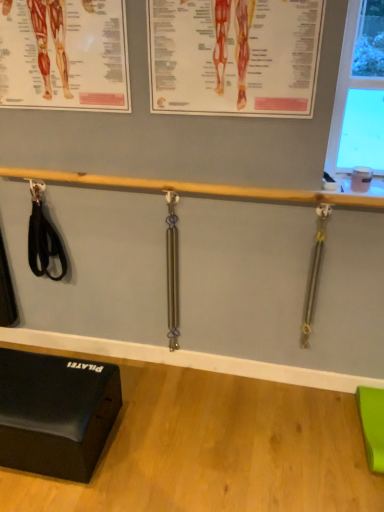
This screenshot has height=512, width=384. I want to click on black rubber exercise block at lower left, so click(55, 413).

What do you see at coordinates (314, 273) in the screenshot?
I see `gold metallic weight at right, the first weight when ordered from right to left` at bounding box center [314, 273].

This screenshot has width=384, height=512. Describe the element at coordinates (234, 56) in the screenshot. I see `orange paper poster at upper center, positioned as the first poster page in right-to-left order` at that location.

What is the approximate width of matte paper poster at upper left, positioned as the second poster page in right-to-left order?

matte paper poster at upper left, positioned as the second poster page in right-to-left order, is 3.39 centimeters wide.

This screenshot has height=512, width=384. Describe the element at coordinates (196, 188) in the screenshot. I see `wooden bar at center` at that location.

Image resolution: width=384 pixels, height=512 pixels. In order to click on black rubber exercise block at lower left in this screenshot , I will do `click(55, 413)`.

How many degrees apart are the facing directions of polished metal weight at center, the 2th weight in the right-to-left sequence, and wooden bar at center?

The angular difference between polished metal weight at center, the 2th weight in the right-to-left sequence, and wooden bar at center is 0.28 degrees.

Considering the points (175, 199) and (3, 170), which point is in front, point (175, 199) or point (3, 170)?

The point (175, 199) is closer.

Which object is more forward, polished metal weight at center, which appears as the 1th weight when viewed from the left, or wooden bar at center?

wooden bar at center is closer to the camera.

Is polished metal weight at center, the 2th weight in the right-to-left sequence, turned away from wooden bar at center?

No, wooden bar at center is not at the back of polished metal weight at center, the 2th weight in the right-to-left sequence.

How much distance is there between wooden bar at center and polished metal weight at center, the 2th weight in the right-to-left sequence?

They are 15.19 inches apart.

Is wooden bar at center closer to the viewer compared to polished metal weight at center, the 2th weight in the right-to-left sequence?

That is True.

Consider the image. In terms of size, does wooden bar at center appear bigger or smaller than polished metal weight at center, the 2th weight in the right-to-left sequence?

In the image, wooden bar at center appears to be larger than polished metal weight at center, the 2th weight in the right-to-left sequence.

Does wooden bar at center turn towards polished metal weight at center, which appears as the 1th weight when viewed from the left?

No, wooden bar at center is not oriented towards polished metal weight at center, which appears as the 1th weight when viewed from the left.

Can you confirm if orange paper poster at upper center, which is counted as the 2th poster page, starting from the left, is wider than polished metal weight at center, the 2th weight in the right-to-left sequence?

No.

Considering the positions of points (152, 97) and (177, 309), is point (152, 97) closer to camera compared to point (177, 309)?

Yes, it is in front of point (177, 309).

This screenshot has width=384, height=512. Find the location of `the 2nd weight directly beneath the orange paper poster at upper center, which is counted as the 2th poster page, starting from the left (from a real-world perspective)`. the 2nd weight directly beneath the orange paper poster at upper center, which is counted as the 2th poster page, starting from the left (from a real-world perspective) is located at coordinates (172, 271).

Is polished metal weight at center, the 2th weight in the right-to-left sequence, a part of orange paper poster at upper center, positioned as the first poster page in right-to-left order?

No, polished metal weight at center, the 2th weight in the right-to-left sequence, is not a part of orange paper poster at upper center, positioned as the first poster page in right-to-left order.

Is polished metal weight at center, which appears as the 1th weight when viewed from the left, located outside orange paper poster at upper center, positioned as the first poster page in right-to-left order?

Yes, polished metal weight at center, which appears as the 1th weight when viewed from the left, is located beyond the bounds of orange paper poster at upper center, positioned as the first poster page in right-to-left order.

From the image's perspective, is polished metal weight at center, which appears as the 1th weight when viewed from the left, located beneath orange paper poster at upper center, positioned as the first poster page in right-to-left order?

Indeed, from the image's perspective, polished metal weight at center, which appears as the 1th weight when viewed from the left, is shown beneath orange paper poster at upper center, positioned as the first poster page in right-to-left order.

Between point (171, 240) and point (224, 0), which one is positioned behind?

Point (171, 240)

Considering the positions of objects polished metal weight at center, which appears as the 1th weight when viewed from the left, and orange paper poster at upper center, positioned as the first poster page in right-to-left order, in the image provided, who is behind, polished metal weight at center, which appears as the 1th weight when viewed from the left, or orange paper poster at upper center, positioned as the first poster page in right-to-left order,?

Positioned behind is polished metal weight at center, which appears as the 1th weight when viewed from the left.

From the image's perspective, relative to wooden bar at center, is matte paper poster at upper left, positioned as the second poster page in right-to-left order, above or below?

From the image's perspective, matte paper poster at upper left, positioned as the second poster page in right-to-left order, appears above wooden bar at center.

Which point is more forward, (114, 9) or (9, 173)?

The point (114, 9) is in front.

How distant is matte paper poster at upper left, the first poster page in the left-to-right sequence, from wooden bar at center?

matte paper poster at upper left, the first poster page in the left-to-right sequence, and wooden bar at center are 17.46 inches apart from each other.

Find the location of a particular element. Image resolution: width=384 pixels, height=512 pixels. beam on the right of the matte paper poster at upper left, the first poster page in the left-to-right sequence is located at coordinates (x=196, y=188).

Considering the relative sizes of orange paper poster at upper center, positioned as the first poster page in right-to-left order, and wooden bar at center in the image provided, is orange paper poster at upper center, positioned as the first poster page in right-to-left order, wider than wooden bar at center?

Incorrect, the width of orange paper poster at upper center, positioned as the first poster page in right-to-left order, does not surpass that of wooden bar at center.

From a real-world perspective, is orange paper poster at upper center, which is counted as the 2th poster page, starting from the left, positioned above or below wooden bar at center?

In terms of real-world spatial position, orange paper poster at upper center, which is counted as the 2th poster page, starting from the left, is above wooden bar at center.

What's the angular difference between orange paper poster at upper center, positioned as the first poster page in right-to-left order, and wooden bar at center's facing directions?

There is a 0.309-degree angle between the facing directions of orange paper poster at upper center, positioned as the first poster page in right-to-left order, and wooden bar at center.

From a real-world perspective, relative to polished metal weight at center, the 2th weight in the right-to-left sequence, is matte paper poster at upper left, positioned as the second poster page in right-to-left order, vertically above or below?

In terms of real-world spatial position, matte paper poster at upper left, positioned as the second poster page in right-to-left order, is above polished metal weight at center, the 2th weight in the right-to-left sequence.

Can you tell me how much matte paper poster at upper left, positioned as the second poster page in right-to-left order, and polished metal weight at center, the 2th weight in the right-to-left sequence, differ in facing direction?

0.589 degrees.

Is matte paper poster at upper left, the first poster page in the left-to-right sequence, taller or shorter than polished metal weight at center, which appears as the 1th weight when viewed from the left?

Clearly, matte paper poster at upper left, the first poster page in the left-to-right sequence, is shorter compared to polished metal weight at center, which appears as the 1th weight when viewed from the left.

The image size is (384, 512). In the image, there is a polished metal weight at center, the 2th weight in the right-to-left sequence. What are the coordinates of `beam above it (from the image's perspective)` in the screenshot? It's located at (196, 188).

From the image's perspective, count 2nd weights downward from the wooden bar at center and point to it. Please provide its 2D coordinates.

[(172, 271)]

Which object lies nearer to the anchor point wooden bar at center, orange paper poster at upper center, which is counted as the 2th poster page, starting from the left, or gold metallic weight at right, the first weight when ordered from right to left?

orange paper poster at upper center, which is counted as the 2th poster page, starting from the left, lies closer to wooden bar at center than the other object.

Which object lies nearer to the anchor point polished metal weight at center, the 2th weight in the right-to-left sequence, gold metallic weight at right, acting as the 2th weight starting from the left, or orange paper poster at upper center, which is counted as the 2th poster page, starting from the left?

orange paper poster at upper center, which is counted as the 2th poster page, starting from the left, is closer to polished metal weight at center, the 2th weight in the right-to-left sequence.

Which object lies further to the anchor point orange paper poster at upper center, which is counted as the 2th poster page, starting from the left, polished metal weight at center, the 2th weight in the right-to-left sequence, or matte paper poster at upper left, the first poster page in the left-to-right sequence?

polished metal weight at center, the 2th weight in the right-to-left sequence, is further to orange paper poster at upper center, which is counted as the 2th poster page, starting from the left.

Which object lies nearer to the anchor point matte paper poster at upper left, the first poster page in the left-to-right sequence, wooden bar at center or black rubber exercise block at lower left?

wooden bar at center.

Looking at the image, which one is located further to black rubber exercise block at lower left, matte paper poster at upper left, positioned as the second poster page in right-to-left order, or gold metallic weight at right, acting as the 2th weight starting from the left?

The object further to black rubber exercise block at lower left is matte paper poster at upper left, positioned as the second poster page in right-to-left order.

From the image, which object appears to be farther from matte paper poster at upper left, the first poster page in the left-to-right sequence, orange paper poster at upper center, which is counted as the 2th poster page, starting from the left, or gold metallic weight at right, the first weight when ordered from right to left?

gold metallic weight at right, the first weight when ordered from right to left, lies further to matte paper poster at upper left, the first poster page in the left-to-right sequence, than the other object.

Looking at this image, which object lies nearer to the anchor point black rubber exercise block at lower left, gold metallic weight at right, the first weight when ordered from right to left, or wooden bar at center?

wooden bar at center is positioned closer to the anchor black rubber exercise block at lower left.

Which object lies nearer to the anchor point black rubber exercise block at lower left, matte paper poster at upper left, the first poster page in the left-to-right sequence, or polished metal weight at center, the 2th weight in the right-to-left sequence?

Among the two, polished metal weight at center, the 2th weight in the right-to-left sequence, is located nearer to black rubber exercise block at lower left.

You are a GUI agent. You are given a task and a screenshot of the screen. Output one action in this format:
    pyautogui.click(x=<x>, y=<y>)
    Task: Click on the beam situated between polished metal weight at center, the 2th weight in the right-to-left sequence, and gold metallic weight at right, acting as the 2th weight starting from the left, from left to right
    Image resolution: width=384 pixels, height=512 pixels.
    Given the screenshot: What is the action you would take?
    pyautogui.click(x=196, y=188)

Where is `beam located between matte paper poster at upper left, the first poster page in the left-to-right sequence, and gold metallic weight at right, acting as the 2th weight starting from the left, in the left-right direction`? Image resolution: width=384 pixels, height=512 pixels. beam located between matte paper poster at upper left, the first poster page in the left-to-right sequence, and gold metallic weight at right, acting as the 2th weight starting from the left, in the left-right direction is located at coordinates (196, 188).

Image resolution: width=384 pixels, height=512 pixels. I want to click on beam between matte paper poster at upper left, the first poster page in the left-to-right sequence, and black rubber exercise block at lower left from top to bottom, so click(196, 188).

The image size is (384, 512). I want to click on weight between matte paper poster at upper left, positioned as the second poster page in right-to-left order, and polished metal weight at center, which appears as the 1th weight when viewed from the left, vertically, so tap(314, 273).